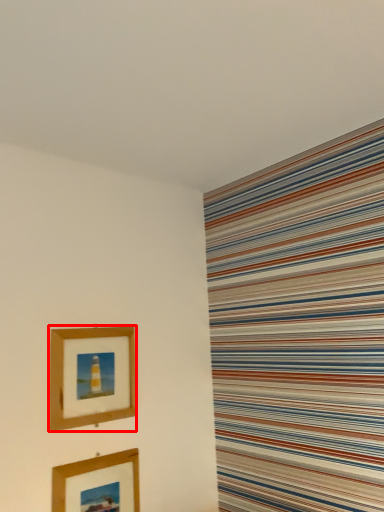
Question: Observing the image, what is the correct spatial positioning of picture frame (annotated by the red box) in reference to picture frame?

Choices:
 (A) left
 (B) right

Answer: (A)